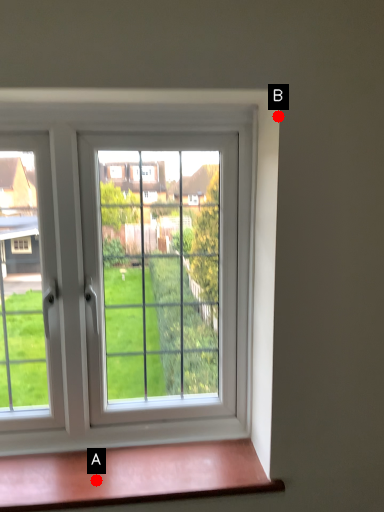
Question: Two points are circled on the image, labeled by A and B beside each circle. Which point appears farthest from the camera in this image?

Choices:
 (A) A is further
 (B) B is further

Answer: (A)